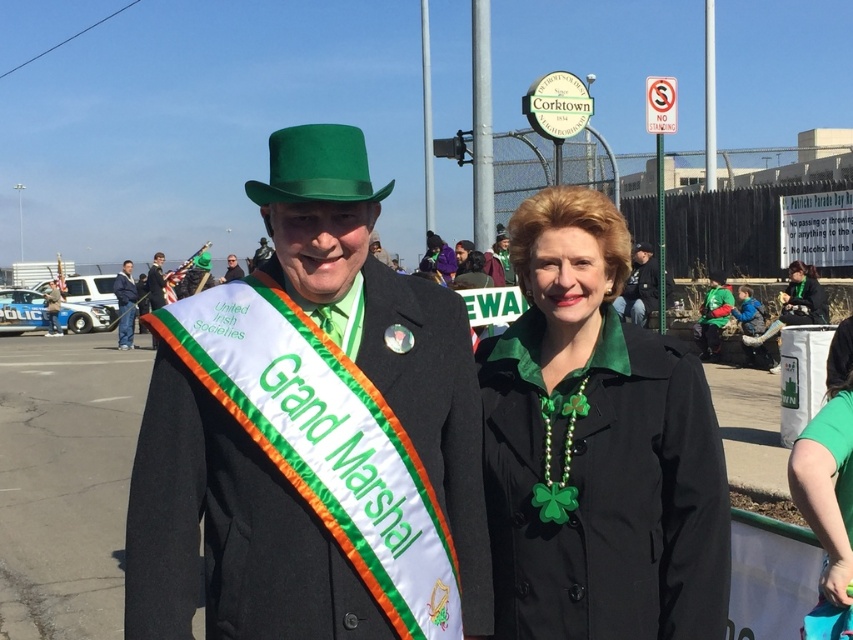
Question: Estimate the real-world distances between objects in this image. Which object is closer to the shiny black jacket at center?

Choices:
 (A) blue denim jacket at left
 (B) green felt hat at upper center
 (C) black matte coat at center

Answer: (A)

Question: Estimate the real-world distances between objects in this image. Which object is farther from the black leather jacket at center?

Choices:
 (A) blue denim jacket at left
 (B) green fabric coat at right

Answer: (A)

Question: Can you confirm if matte green hat at center is positioned above green felt hat at upper center?

Choices:
 (A) yes
 (B) no

Answer: (B)

Question: Is green fabric coat at right to the right of blue denim jacket at left from the viewer's perspective?

Choices:
 (A) no
 (B) yes

Answer: (B)

Question: Which object is the closest to the shiny black jacket at center?

Choices:
 (A) black matte coat at center
 (B) matte black hat at center
 (C) black leather jacket at center

Answer: (B)

Question: Is black matte coat at center smaller than matte black hat at center?

Choices:
 (A) no
 (B) yes

Answer: (B)